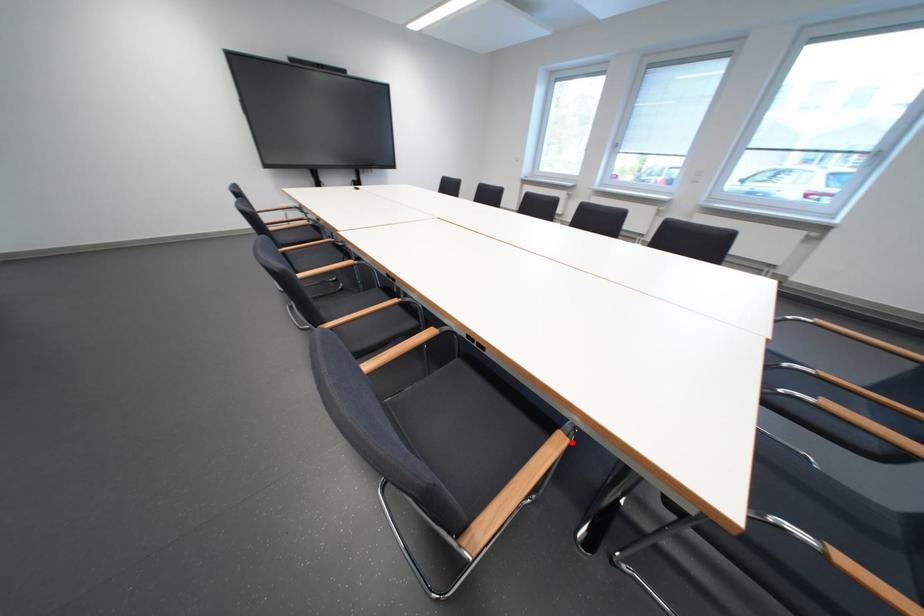
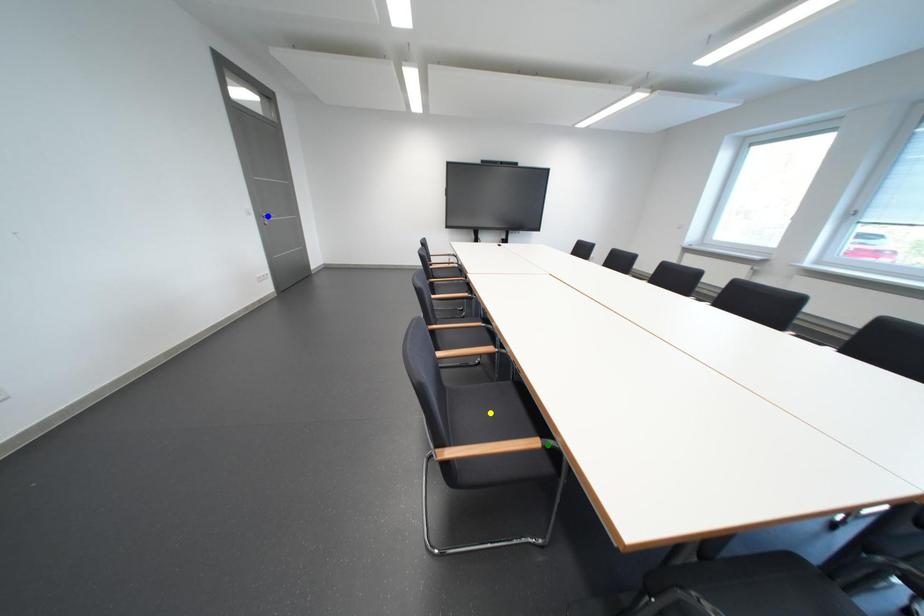
Question: I am providing you with two images of the same scene from different viewpoints. A red point is marked on the first image. You are given multiple points on the second image. Which mark in image 2 goes with the point in image 1?

Choices:
 (A) yellow point
 (B) green point
 (C) blue point

Answer: (B)